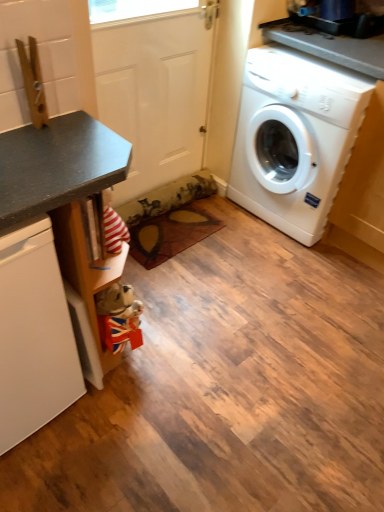
You are a GUI agent. You are given a task and a screenshot of the screen. Output one action in this format:
    pyautogui.click(x=<x>, y=<y>)
    Task: Click on the vacant area in front of white plastic washing machine at right
    Image resolution: width=384 pixels, height=512 pixels.
    Given the screenshot: What is the action you would take?
    pyautogui.click(x=282, y=270)